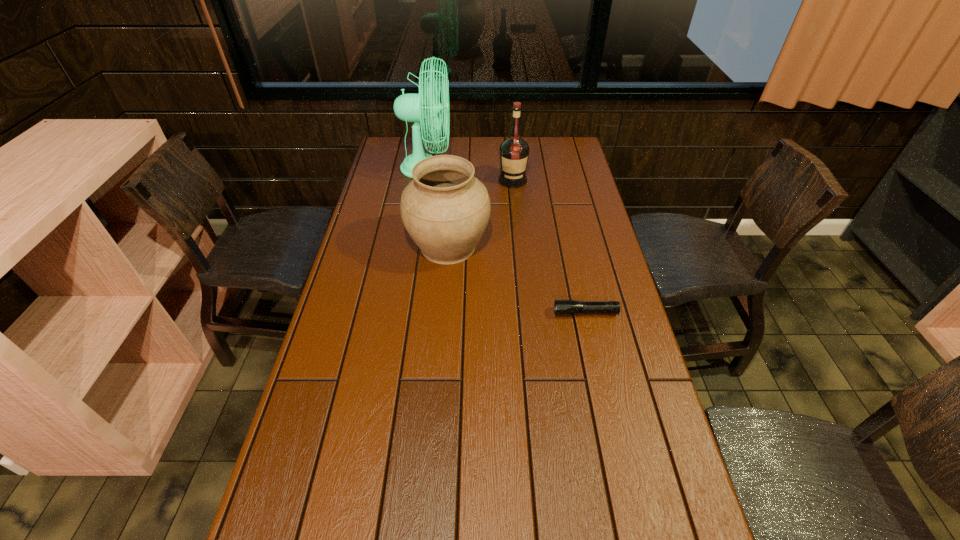
Locate an element on the screen. The width and height of the screenshot is (960, 540). the tallest object is located at coordinates (419, 108).

This screenshot has height=540, width=960. What are the coordinates of `liquor` in the screenshot? It's located at (514, 152).

This screenshot has width=960, height=540. Identify the location of urn. (445, 209).

Where is `the rightmost object`? the rightmost object is located at coordinates (561, 307).

I want to click on the shortest object, so click(561, 307).

Locate an element on the screen. vacant space located in front of the tallest object to blow air is located at coordinates (504, 168).

Image resolution: width=960 pixels, height=540 pixels. What are the coordinates of `vacant space located on the surface of the third object from left to right` in the screenshot? It's located at (518, 238).

Find the location of a particular element. This screenshot has width=960, height=540. vacant space located on the back of the third farthest object is located at coordinates (451, 205).

Identify the location of free spot located 0.140m at the lens end of the shortest object. (505, 313).

This screenshot has height=540, width=960. What are the coordinates of `free space located at the lens end of the shortest object` in the screenshot? It's located at (501, 313).